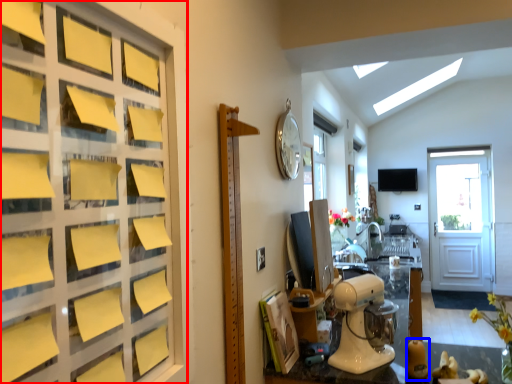
Question: Which point is further to the camera, door (highlighted by a red box) or toy (highlighted by a blue box)?

Choices:
 (A) door
 (B) toy

Answer: (B)